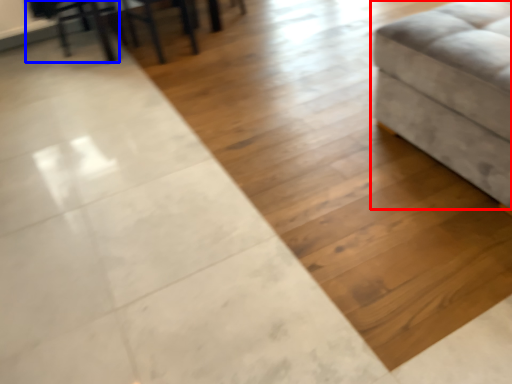
Question: Among these objects, which one is nearest to the camera, furniture (highlighted by a red box) or swivel chair (highlighted by a blue box)?

Choices:
 (A) furniture
 (B) swivel chair

Answer: (A)